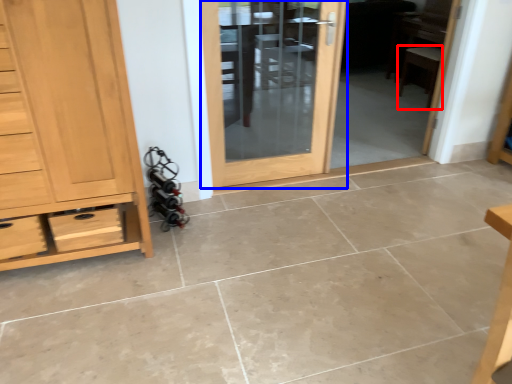
Question: Among these objects, which one is nearest to the camera, chair (highlighted by a red box) or door (highlighted by a blue box)?

Choices:
 (A) chair
 (B) door

Answer: (B)